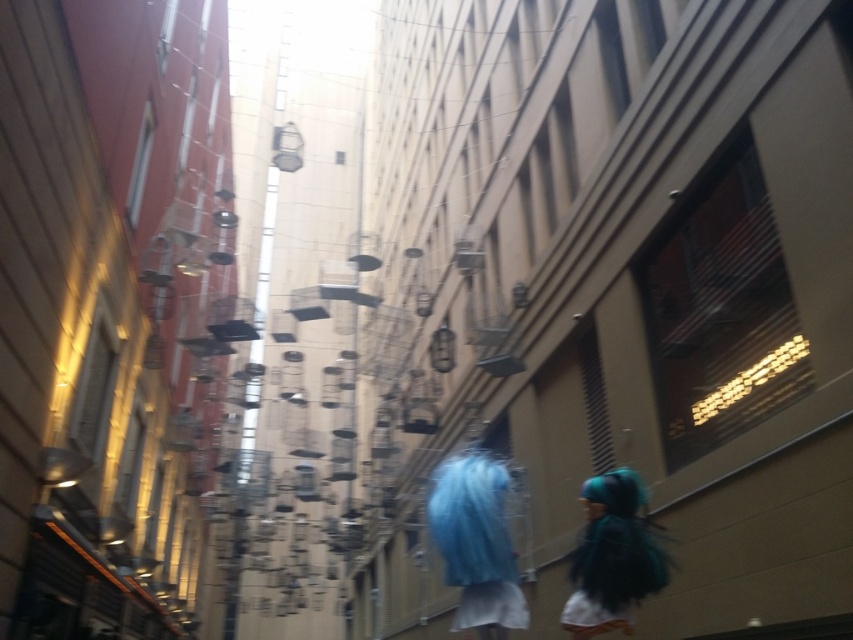
Who is higher up, blue fuzzy wig at center or teal matte wig at lower right?

blue fuzzy wig at center is above.

Is blue fuzzy wig at center above teal matte wig at lower right?

Indeed, blue fuzzy wig at center is positioned over teal matte wig at lower right.

What do you see at coordinates (476, 544) in the screenshot? The height and width of the screenshot is (640, 853). I see `blue fuzzy wig at center` at bounding box center [476, 544].

At what (x,y) coordinates should I click in order to perform the action: click on blue fuzzy wig at center. Please return your answer as a coordinate pair (x, y). The height and width of the screenshot is (640, 853). Looking at the image, I should click on (476, 544).